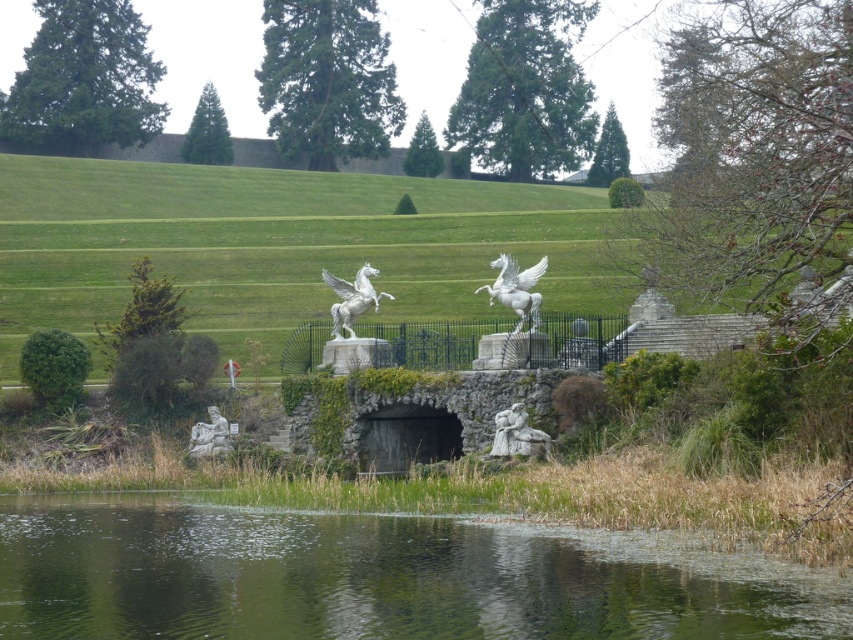
Does green reflective water at lower center have a smaller size compared to white marble horse at center?

No, green reflective water at lower center is not smaller than white marble horse at center.

Is green reflective water at lower center thinner than white marble horse at center?

In fact, green reflective water at lower center might be wider than white marble horse at center.

Find the location of `green reflective water at lower center`. green reflective water at lower center is located at coordinates (379, 577).

I want to click on green reflective water at lower center, so click(379, 577).

Which of these two, carved stone figure at center or white stone statue at lower left, stands shorter?

Standing shorter between the two is white stone statue at lower left.

Does carved stone figure at center come in front of white stone statue at lower left?

Yes, carved stone figure at center is closer to the viewer.

Is point (506, 435) farther from camera compared to point (202, 428)?

No, (506, 435) is in front of (202, 428).

Find the location of `carved stone figure at center`. carved stone figure at center is located at coordinates (517, 435).

Who is positioned more to the right, white stone hillside at center or carved stone figure at center?

From the viewer's perspective, carved stone figure at center appears more on the right side.

This screenshot has width=853, height=640. What are the coordinates of `white stone hillside at center` in the screenshot? It's located at (277, 244).